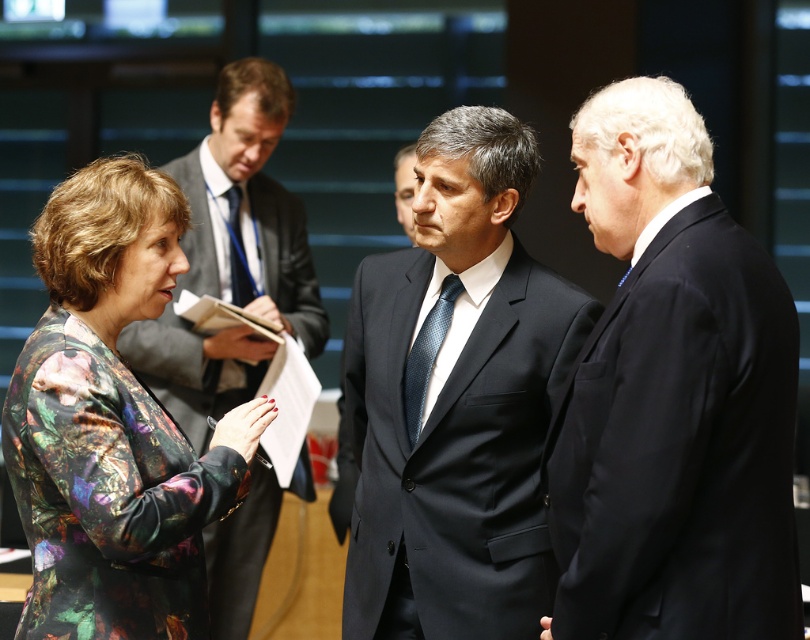
You are organizing a photo shoot and need to arrange these two items in a display case. The display case can only accommodate items up to the width of the black suit at right. Will the dark blue textured tie at center fit in the display case?

The dark blue textured tie at center will fit in the display case because the black suit at right is wider than the dark blue textured tie at center, and the display case can accommodate the black suit at right.

What is the color of the suit worn by the person standing at the coordinates point (672,397)?

The person at point (672,397) is wearing a black suit.